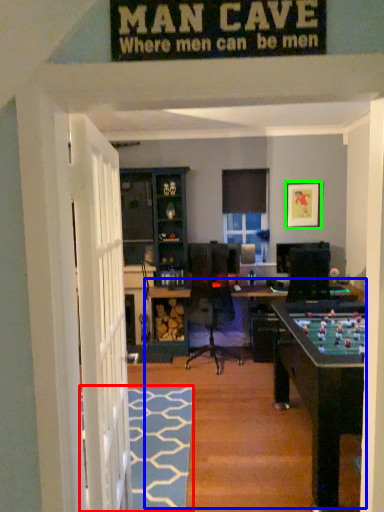
Question: Estimate the real-world distances between objects in this image. Which object is closer to doormat (highlighted by a red box), table (highlighted by a blue box) or picture frame (highlighted by a green box)?

Choices:
 (A) table
 (B) picture frame

Answer: (A)